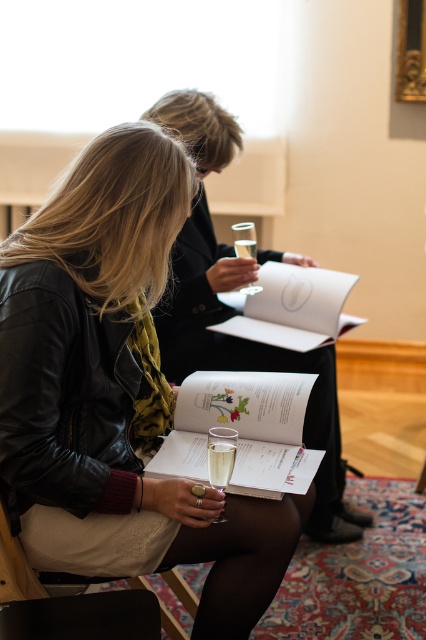
Which is above, translucent glass at lower center or clear glass at center?

clear glass at center is above.

Does translucent glass at lower center have a greater height compared to clear glass at center?

No.

Is point (210, 448) farther from camera compared to point (233, 228)?

That is False.

In order to click on translucent glass at lower center in this screenshot , I will do `click(219, 461)`.

Which is in front, point (207, 442) or point (224, 472)?

Point (224, 472) is in front.

Is clear glass wine glass at lower center thinner than translucent glass at lower center?

In fact, clear glass wine glass at lower center might be wider than translucent glass at lower center.

Find the location of a particular element. This screenshot has height=640, width=426. clear glass wine glass at lower center is located at coordinates (221, 456).

Looking at this image, who is more forward, (137, 212) or (226, 481)?

Positioned in front is point (226, 481).

Is leather jacket at center positioned behind translucent glass at lower center?

That is False.

Between point (106, 524) and point (213, 449), which one is positioned behind?

The point (106, 524) is more distant.

This screenshot has height=640, width=426. Identify the location of leather jacket at center. (117, 392).